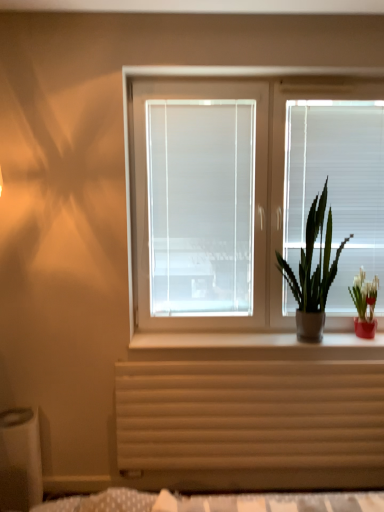
Question: Is white matte blind at right in contact with white matte window box at lower left?

Choices:
 (A) yes
 (B) no

Answer: (B)

Question: Is white matte blind at right not inside white matte window box at lower left?

Choices:
 (A) yes
 (B) no

Answer: (A)

Question: Considering the relative positions of white matte blind at right and white matte window box at lower left in the image provided, is white matte blind at right to the right of white matte window box at lower left from the viewer's perspective?

Choices:
 (A) no
 (B) yes

Answer: (B)

Question: From the image's perspective, is white matte blind at right located beneath white matte window box at lower left?

Choices:
 (A) no
 (B) yes

Answer: (A)

Question: Considering the relative sizes of white matte blind at right and white matte window box at lower left in the image provided, is white matte blind at right smaller than white matte window box at lower left?

Choices:
 (A) yes
 (B) no

Answer: (B)

Question: From a real-world perspective, relative to white matte blind at right, is white matte window screen at center vertically above or below?

Choices:
 (A) below
 (B) above

Answer: (A)

Question: Is white matte window screen at center in front of or behind white matte blind at right in the image?

Choices:
 (A) front
 (B) behind

Answer: (A)

Question: From the image's perspective, relative to white matte blind at right, is white matte window screen at center above or below?

Choices:
 (A) below
 (B) above

Answer: (A)

Question: Considering the positions of white matte window screen at center and white matte blind at right in the image, is white matte window screen at center taller or shorter than white matte blind at right?

Choices:
 (A) tall
 (B) short

Answer: (A)

Question: In terms of size, does green matte plant at right, which is the first houseplant from left to right, appear bigger or smaller than wooden radiator at lower center?

Choices:
 (A) small
 (B) big

Answer: (B)

Question: In terms of height, does green matte plant at right, which is the first houseplant from left to right, look taller or shorter compared to wooden radiator at lower center?

Choices:
 (A) tall
 (B) short

Answer: (A)

Question: From the image's perspective, relative to wooden radiator at lower center, is green matte plant at right, which is the first houseplant from left to right, above or below?

Choices:
 (A) below
 (B) above

Answer: (B)

Question: Is green matte plant at right, the second houseplant in the right-to-left sequence, inside the boundaries of wooden radiator at lower center, or outside?

Choices:
 (A) inside
 (B) outside

Answer: (B)

Question: Is point (314, 245) closer or farther from the camera than point (210, 420)?

Choices:
 (A) closer
 (B) farther

Answer: (B)

Question: Is white matte blind at right inside the boundaries of wooden radiator at lower center, or outside?

Choices:
 (A) outside
 (B) inside

Answer: (A)